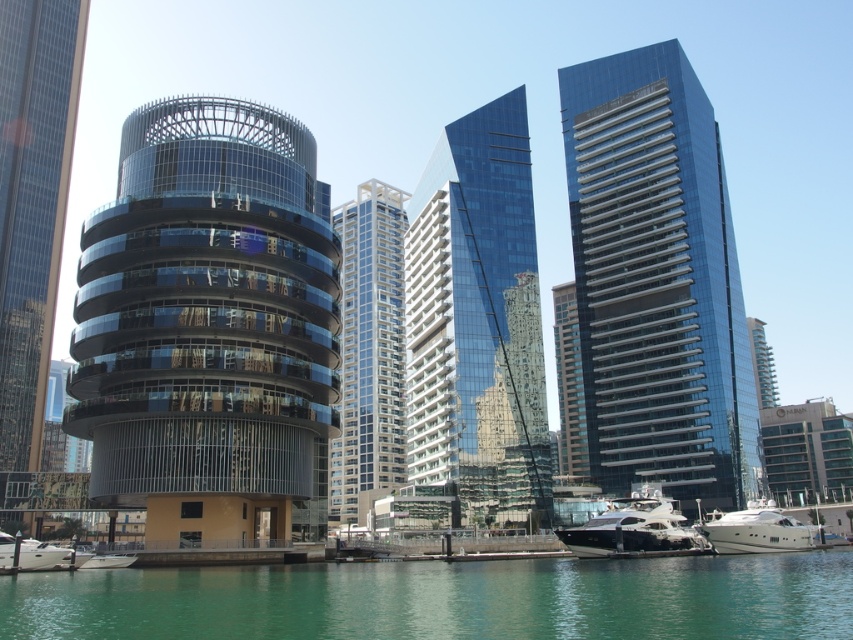
Between point (749, 541) and point (763, 369), which one is positioned behind?

The point (763, 369) is behind.

What do you see at coordinates (757, 531) in the screenshot?
I see `white glossy yacht at lower right` at bounding box center [757, 531].

The image size is (853, 640). What are the coordinates of `white glossy yacht at lower right` in the screenshot? It's located at (757, 531).

Does glassy metallic tower at center have a greater width compared to shiny glass skyscraper at center?

No.

Between glassy metallic tower at center and shiny glass skyscraper at center, which one appears on the left side from the viewer's perspective?

From the viewer's perspective, glassy metallic tower at center appears more on the left side.

The image size is (853, 640). What are the coordinates of `glassy metallic tower at center` in the screenshot? It's located at (209, 323).

Can you confirm if shiny glass skyscraper at center is wider than glassy modern building at left?

A: Yes.

Which is more to the left, shiny glass skyscraper at center or glassy modern building at left?

glassy modern building at left is more to the left.

What do you see at coordinates (657, 282) in the screenshot? I see `shiny glass skyscraper at center` at bounding box center [657, 282].

Image resolution: width=853 pixels, height=640 pixels. In order to click on shiny glass skyscraper at center in this screenshot , I will do `click(657, 282)`.